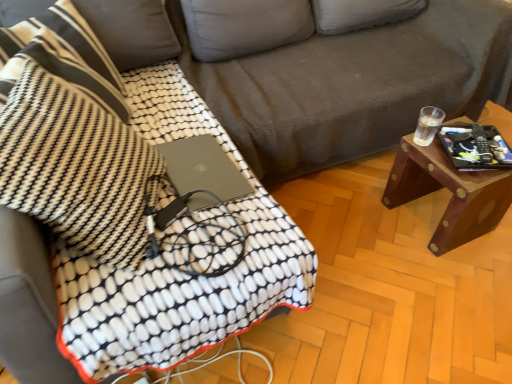
Locate an element on the screen. vacant region to the left of woodenmaterial/texturetable at right is located at coordinates (362, 220).